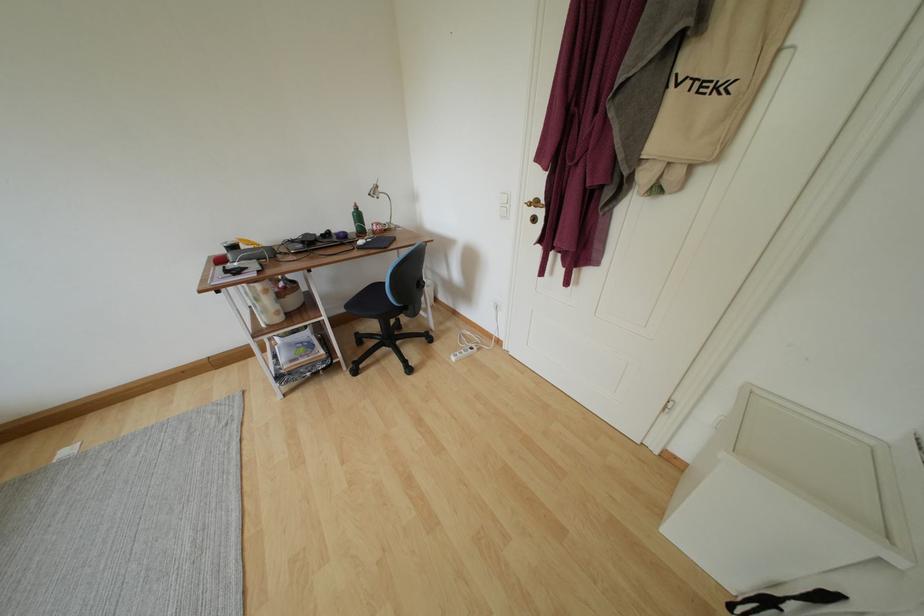
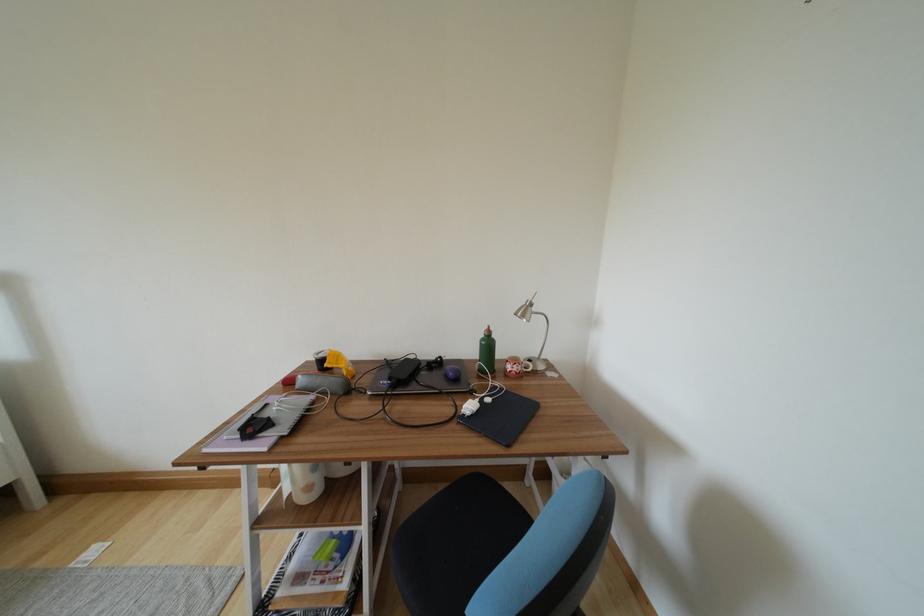
Where in the second image is the point corresponding to point 283,317 from the first image?

(313, 492)